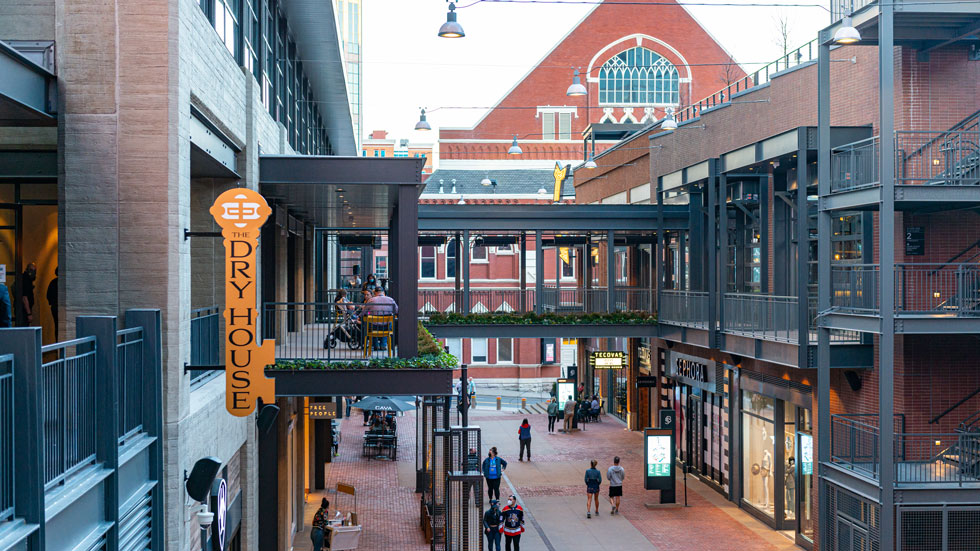
The height and width of the screenshot is (551, 980). What are the coordinates of `church style window ground floor of building` in the screenshot? It's located at (483, 352).